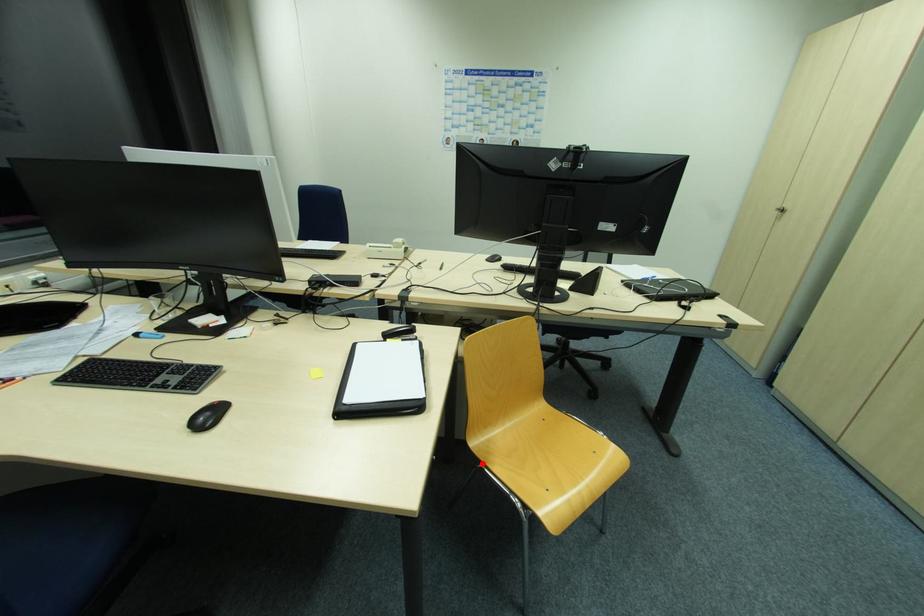
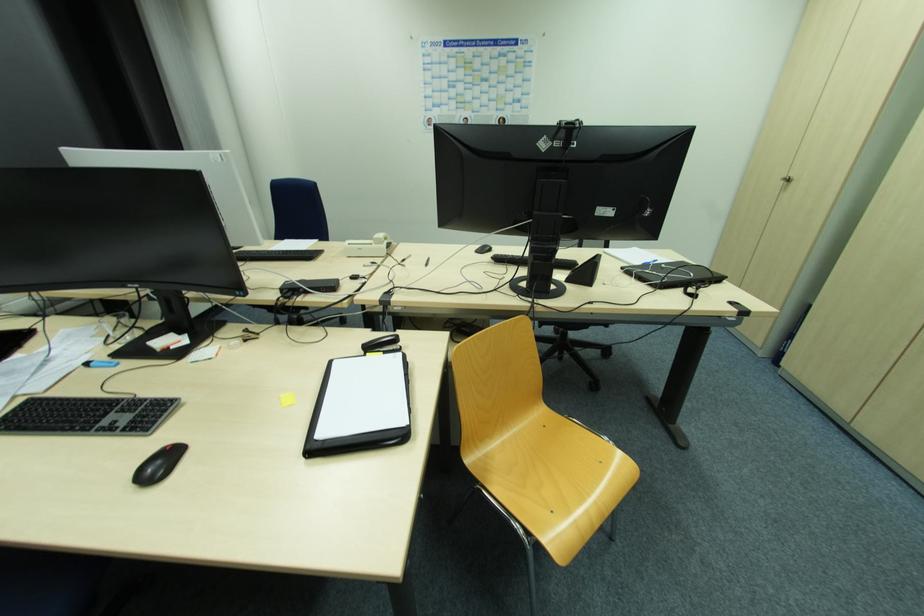
The point at the highlighted location is marked in the first image. Where is the corresponding point in the second image?

(480, 483)